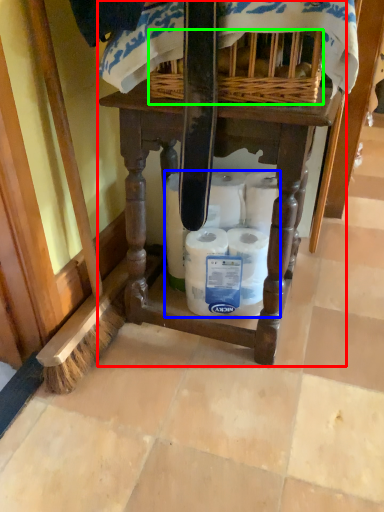
Question: Which object is the farthest from furniture (highlighted by a red box)? Choose among these: toilet paper (highlighted by a blue box) or basket (highlighted by a green box).

Choices:
 (A) toilet paper
 (B) basket

Answer: (B)